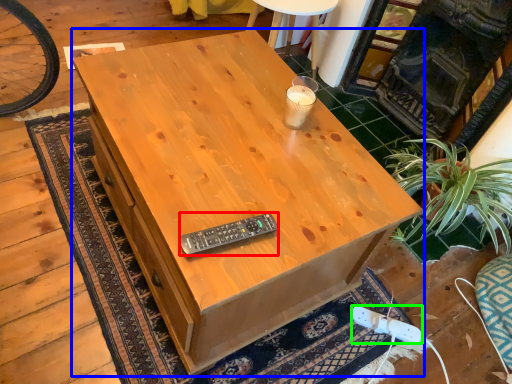
Question: Which is nearer to the control (highlighted by a red box)? desk (highlighted by a blue box) or plug (highlighted by a green box).

Choices:
 (A) desk
 (B) plug

Answer: (A)